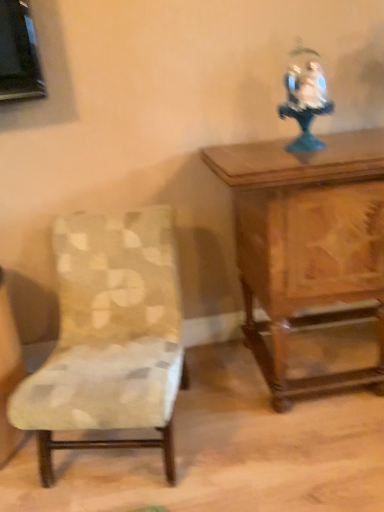
Locate an element on the screen. vacant area situated below patterned fabric chair at left (from a real-world perspective) is located at coordinates (107, 460).